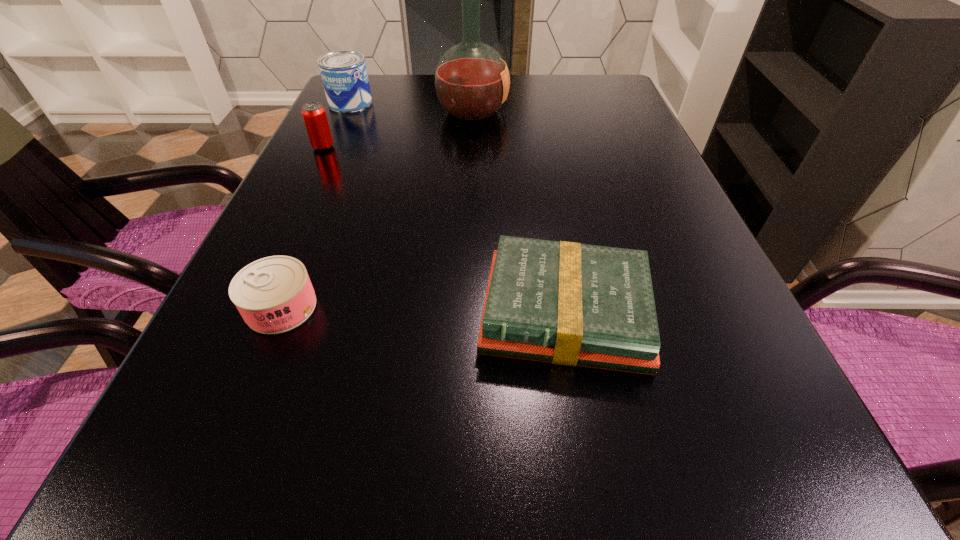
The image size is (960, 540). What are the coordinates of `the tallest object` in the screenshot? It's located at (471, 80).

Identify the location of the farthest can. The image size is (960, 540). (344, 75).

I want to click on the third tallest object, so click(314, 114).

Find the location of a particular element. The height and width of the screenshot is (540, 960). the second shortest can is located at coordinates (314, 114).

Identify the location of hardback book. Image resolution: width=960 pixels, height=540 pixels. (566, 303).

Locate an element on the screen. The image size is (960, 540). the nearest can is located at coordinates tap(274, 294).

Identify the location of free region located 0.320m on the front label of the tallest object. The height and width of the screenshot is (540, 960). (627, 110).

Locate an element on the screen. The image size is (960, 540). free space located 0.220m on the front label of the farthest can is located at coordinates (451, 103).

Locate an element on the screen. This screenshot has width=960, height=540. vacant space situated 0.350m on the back of the second nearest can is located at coordinates (354, 82).

Find the location of a particular element. The image size is (960, 540). vacant area located on the left of the hardback book is located at coordinates [251, 314].